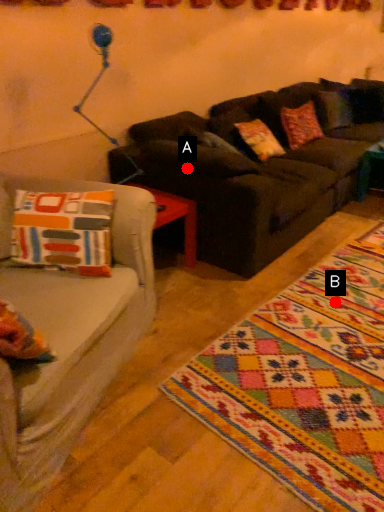
Question: Two points are circled on the image, labeled by A and B beside each circle. Which point appears closest to the camera in this image?

Choices:
 (A) A is closer
 (B) B is closer

Answer: (B)